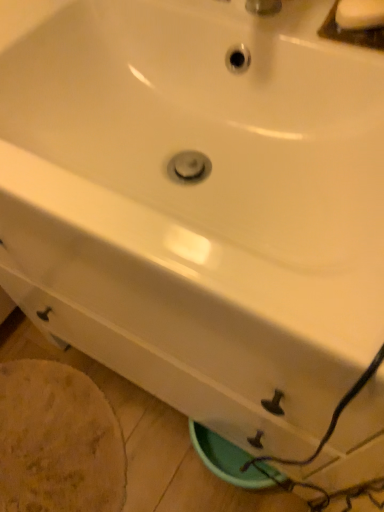
I want to click on white matte soap at upper right, so click(x=359, y=14).

This screenshot has height=512, width=384. Describe the element at coordinates (359, 14) in the screenshot. I see `white matte soap at upper right` at that location.

The width and height of the screenshot is (384, 512). I want to click on white matte soap at upper right, so click(359, 14).